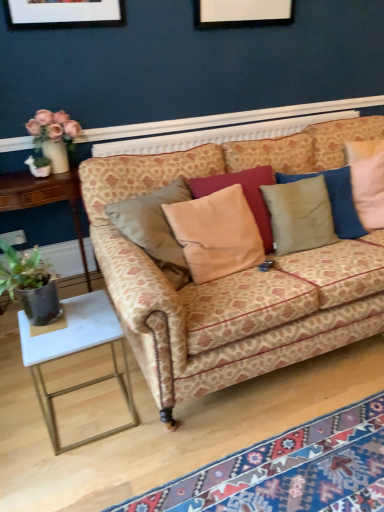
At what (x,y) coordinates should I click in order to perform the action: click on vacant space to the right of white marble side table at lower left, which is the first table in front-to-back order. Please return your answer as a coordinate pair (x, y). Looking at the image, I should click on (166, 426).